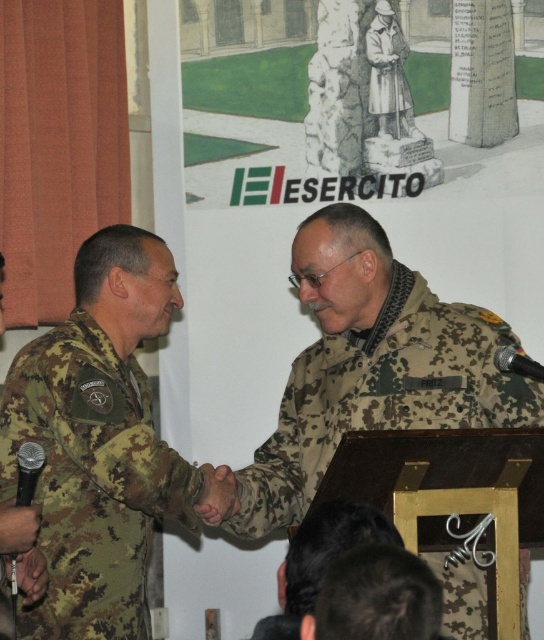
You are a military photographer at the event. You need to capture a photo where both the camouflage fabric uniform at upper center and the camouflage uniform at left are visible. Based on their positions, which one should be positioned closer to the right side of the photo?

The camouflage fabric uniform at upper center should be positioned closer to the right side of the photo since it is already located to the right of the camouflage uniform at left.

You are an observer at the ceremony. You see the camouflage fabric uniform at upper center and the camouflage uniform at left. Which one appears taller in the image?

The camouflage fabric uniform at upper center is taller than the camouflage uniform at left.